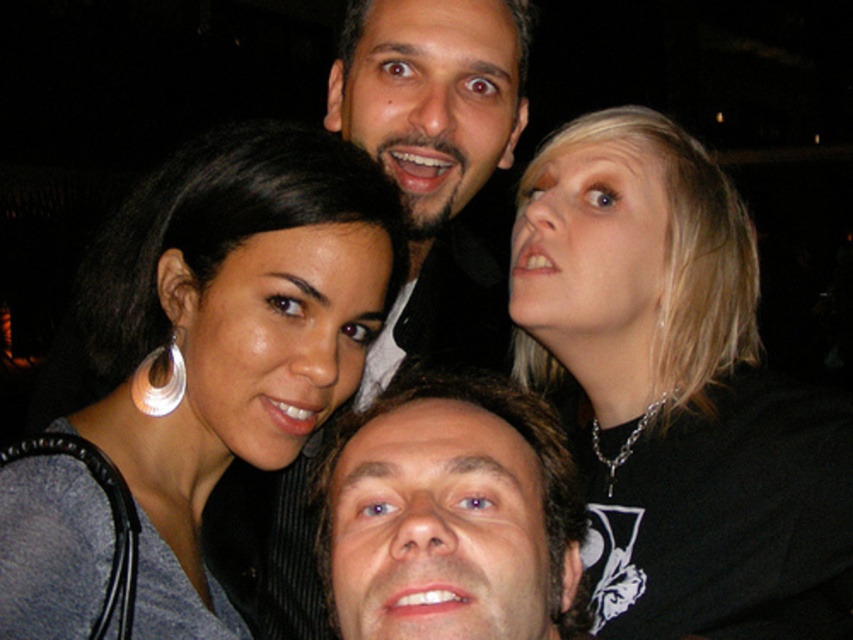
Can you confirm if bearded man at center is taller than white plastic hoop at upper left?

Yes.

Is bearded man at center to the left of white plastic hoop at upper left from the viewer's perspective?

No, bearded man at center is not to the left of white plastic hoop at upper left.

The width and height of the screenshot is (853, 640). What are the coordinates of `bearded man at center` in the screenshot? It's located at (428, 124).

Which is above, shiny silver necklace at upper right or white plastic hoop at upper left?

white plastic hoop at upper left

The image size is (853, 640). I want to click on shiny silver necklace at upper right, so click(x=671, y=381).

Image resolution: width=853 pixels, height=640 pixels. What are the coordinates of `shiny silver necklace at upper right` in the screenshot? It's located at pos(671,381).

Where is `shiny silver necklace at upper right`? The height and width of the screenshot is (640, 853). shiny silver necklace at upper right is located at coordinates (671, 381).

Is shiny silver necklace at upper right above matte black hair at upper left?

No.

Is shiny silver necklace at upper right smaller than matte black hair at upper left?

Yes.

Between point (611, 227) and point (163, 600), which one is positioned behind?

Positioned behind is point (611, 227).

Locate an element on the screen. The width and height of the screenshot is (853, 640). shiny silver necklace at upper right is located at coordinates (671, 381).